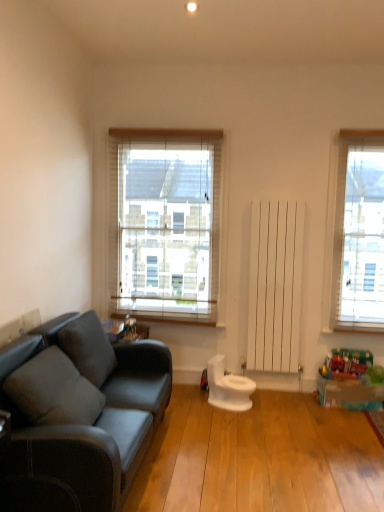
Identify the location of free space in front of white glossy toilet at center. (223, 420).